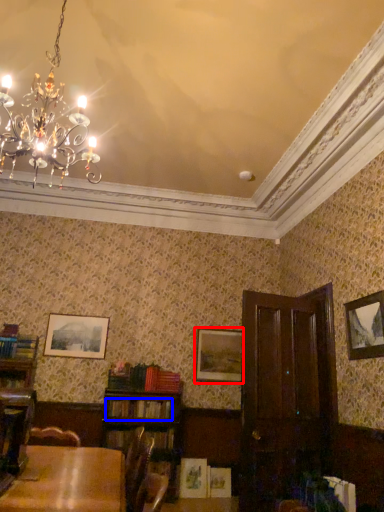
Question: Which point is closer to the camera, picture frame (highlighted by a red box) or book (highlighted by a blue box)?

Choices:
 (A) picture frame
 (B) book

Answer: (B)